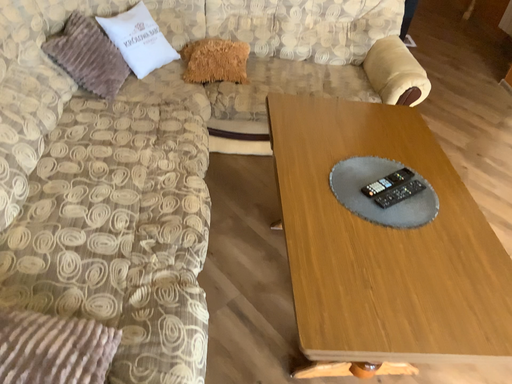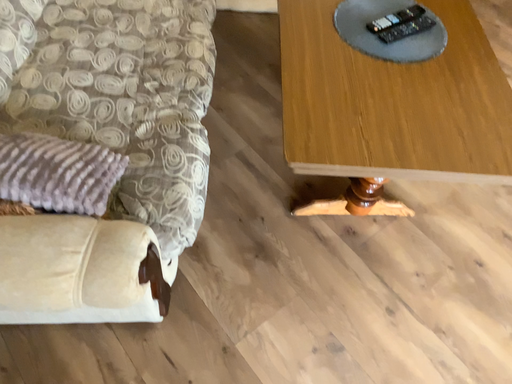
Question: How did the camera likely rotate when shooting the video?

Choices:
 (A) rotated upward
 (B) rotated downward

Answer: (B)